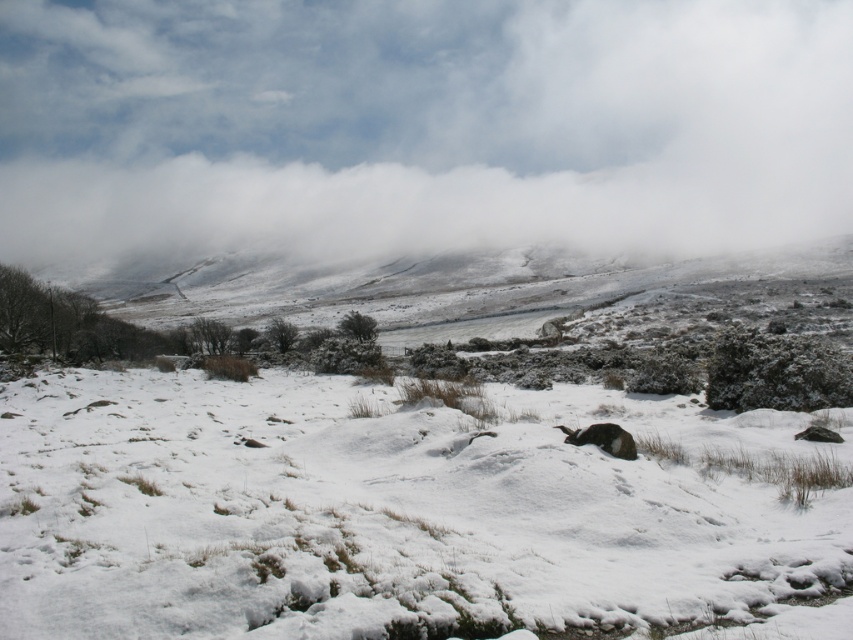
You are an observer standing in the winter landscape. You see the white fluffy cloud at upper center and the furry black animal at center. Which object is higher in the sky?

The white fluffy cloud at upper center is higher in the sky than the furry black animal at center because it is positioned above it.